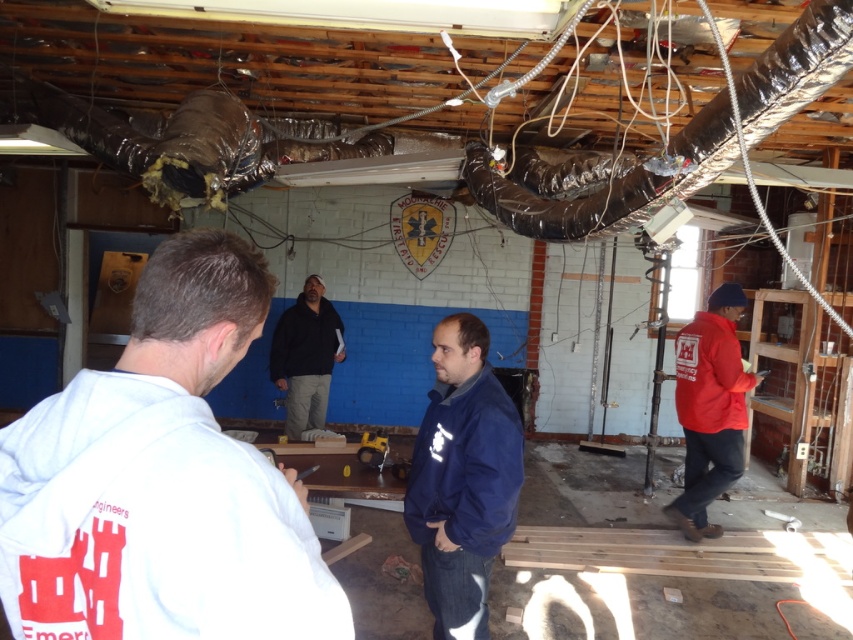
You are an emergency worker entering the garage and see the white fleece jacket at upper left and the red matte jacket at lower right. Which jacket should you choose if you need a larger jacket for cold weather?

The red matte jacket at lower right is larger in size compared to the white fleece jacket at upper left, so you should choose the red matte jacket at lower right for cold weather.